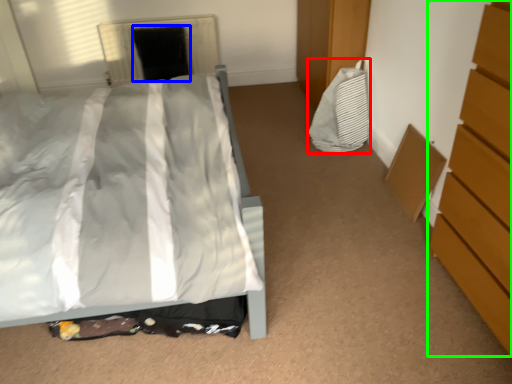
Question: Which object is the farthest from material (highlighted by a red box)? Choose among these: screen door (highlighted by a blue box) or chest of drawers (highlighted by a green box).

Choices:
 (A) screen door
 (B) chest of drawers

Answer: (A)